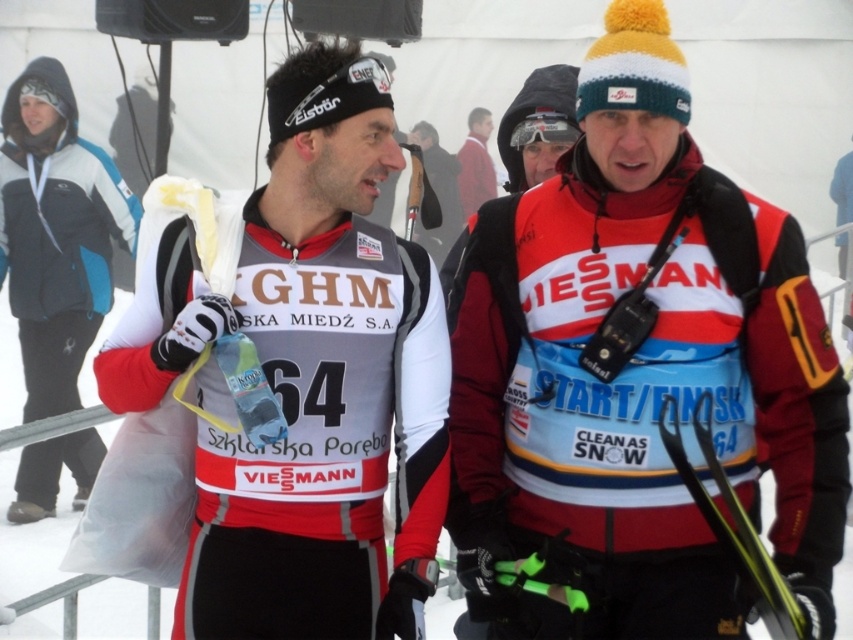
Question: Which is nearer to the matte white jersey at center?

Choices:
 (A) blue synthetic jacket at left
 (B) red wool sweater at center
 (C) matte black goggles at center

Answer: (C)

Question: Can you confirm if red fabric jacket at center is positioned above blue synthetic jacket at left?

Choices:
 (A) no
 (B) yes

Answer: (A)

Question: From the image, what is the correct spatial relationship of red fabric jacket at center in relation to yellow metallic ski at lower right?

Choices:
 (A) left
 (B) right

Answer: (A)

Question: In this image, where is red fabric jacket at center located relative to black plastic ski at center?

Choices:
 (A) right
 (B) left

Answer: (A)

Question: Estimate the real-world distances between objects in this image. Which object is farther from the blue synthetic jacket at left?

Choices:
 (A) black plastic ski at center
 (B) matte black goggles at center
 (C) red fabric jacket at center
 (D) red wool sweater at center

Answer: (D)

Question: Which point is closer to the camera?

Choices:
 (A) red fabric jacket at center
 (B) yellow metallic ski at lower right

Answer: (B)